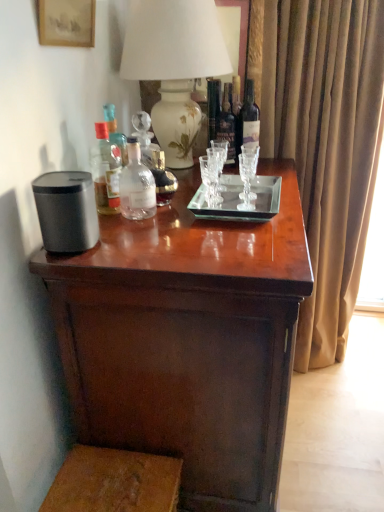
Where is `vacant space in front of translucent glass bottle at upper left, arranged as the first bottle when viewed from the left`? This screenshot has height=512, width=384. vacant space in front of translucent glass bottle at upper left, arranged as the first bottle when viewed from the left is located at coordinates point(121,236).